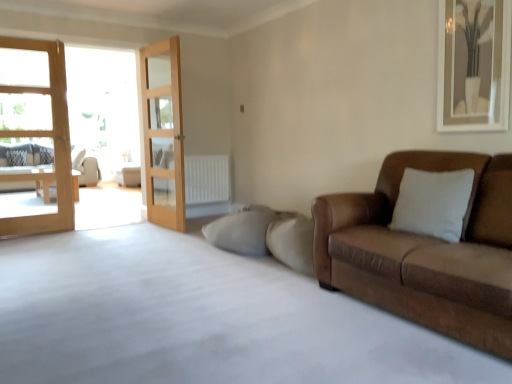
Question: Is wooden glass door at center, arranged as the 2th door when viewed from the left, shorter than beige fabric couch at left, the 1th studio couch in the back-to-front sequence?

Choices:
 (A) no
 (B) yes

Answer: (A)

Question: Can you confirm if wooden glass door at center, arranged as the first door when viewed from the right, is bigger than beige fabric couch at left, positioned as the second studio couch in right-to-left order?

Choices:
 (A) yes
 (B) no

Answer: (B)

Question: From the image's perspective, would you say wooden glass door at center, arranged as the first door when viewed from the right, is positioned over beige fabric couch at left, the 1th studio couch in the back-to-front sequence?

Choices:
 (A) yes
 (B) no

Answer: (A)

Question: From a real-world perspective, is wooden glass door at center, arranged as the first door when viewed from the right, physically below beige fabric couch at left, positioned as the second studio couch in right-to-left order?

Choices:
 (A) no
 (B) yes

Answer: (A)

Question: Is wooden glass door at center, arranged as the first door when viewed from the right, at the left side of beige fabric couch at left, the 2th studio couch positioned from the front?

Choices:
 (A) no
 (B) yes

Answer: (A)

Question: In terms of height, does brown leather couch at right, the 2th studio couch when ordered from left to right, look taller or shorter compared to white textured radiator at center?

Choices:
 (A) short
 (B) tall

Answer: (B)

Question: From a real-world perspective, is brown leather couch at right, the first studio couch positioned from the front, physically located above or below white textured radiator at center?

Choices:
 (A) above
 (B) below

Answer: (B)

Question: Visually, is brown leather couch at right, the 2th studio couch when ordered from left to right, positioned to the left or to the right of white textured radiator at center?

Choices:
 (A) right
 (B) left

Answer: (A)

Question: Is brown leather couch at right, the first studio couch positioned from the front, spatially inside white textured radiator at center, or outside of it?

Choices:
 (A) inside
 (B) outside

Answer: (B)

Question: Choose the correct answer: Is white textured radiator at center inside wooden glass door at center, arranged as the 2th door when viewed from the left, or outside it?

Choices:
 (A) inside
 (B) outside

Answer: (B)

Question: Considering the positions of white textured radiator at center and wooden glass door at center, arranged as the first door when viewed from the right, in the image, is white textured radiator at center taller or shorter than wooden glass door at center, arranged as the first door when viewed from the right,?

Choices:
 (A) tall
 (B) short

Answer: (B)

Question: Is white textured radiator at center wider or thinner than wooden glass door at center, arranged as the 2th door when viewed from the left?

Choices:
 (A) wide
 (B) thin

Answer: (A)

Question: From a real-world perspective, relative to wooden glass door at center, arranged as the 2th door when viewed from the left, is white textured radiator at center vertically above or below?

Choices:
 (A) below
 (B) above

Answer: (A)

Question: Is point (84, 168) positioned closer to the camera than point (8, 162)?

Choices:
 (A) closer
 (B) farther

Answer: (B)

Question: In the image, is beige fabric couch at left, the 1th studio couch in the left-to-right sequence, positioned in front of or behind white textured pillow at left?

Choices:
 (A) behind
 (B) front

Answer: (B)